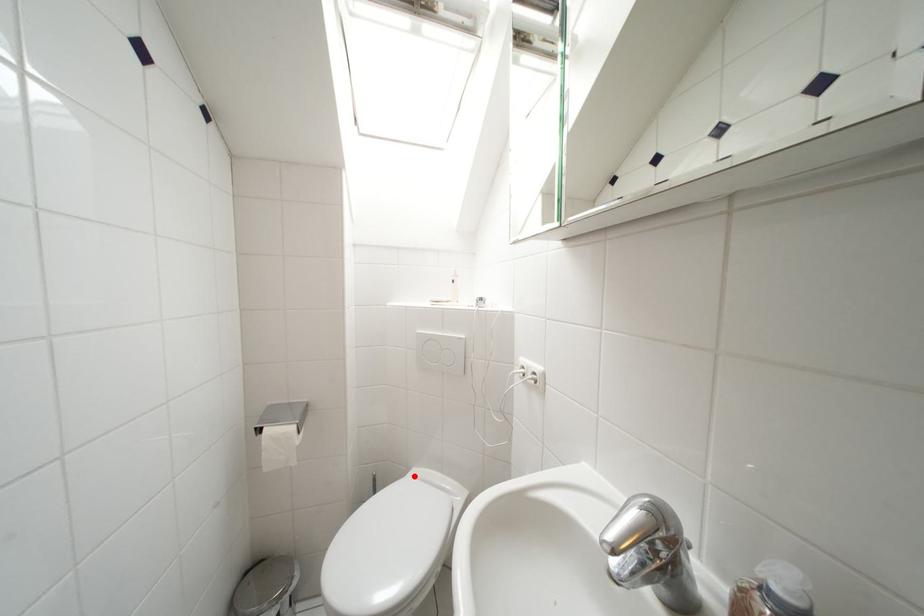
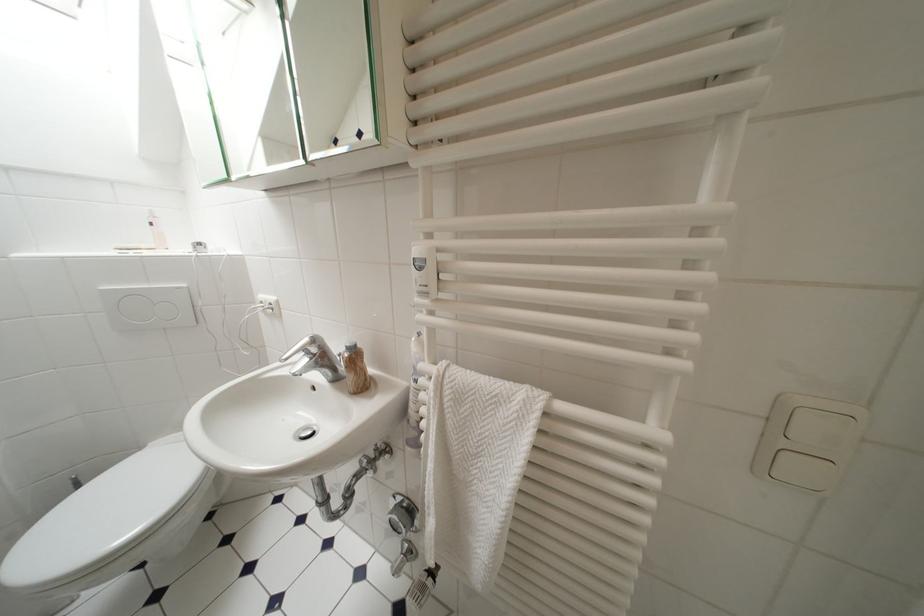
Where in the second image is the point corresponding to the highlighted location from the first image?

(148, 451)